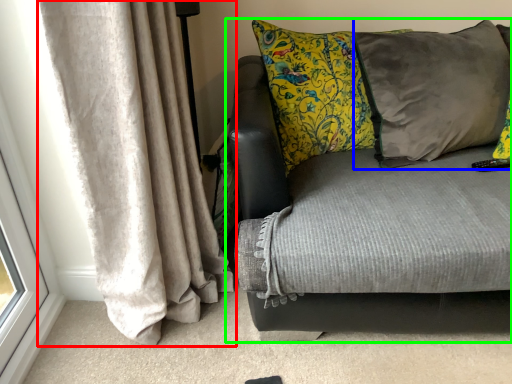
Question: Estimate the real-world distances between objects in this image. Which object is farther from curtain (highlighted by a red box), pillow (highlighted by a blue box) or studio couch (highlighted by a green box)?

Choices:
 (A) pillow
 (B) studio couch

Answer: (A)